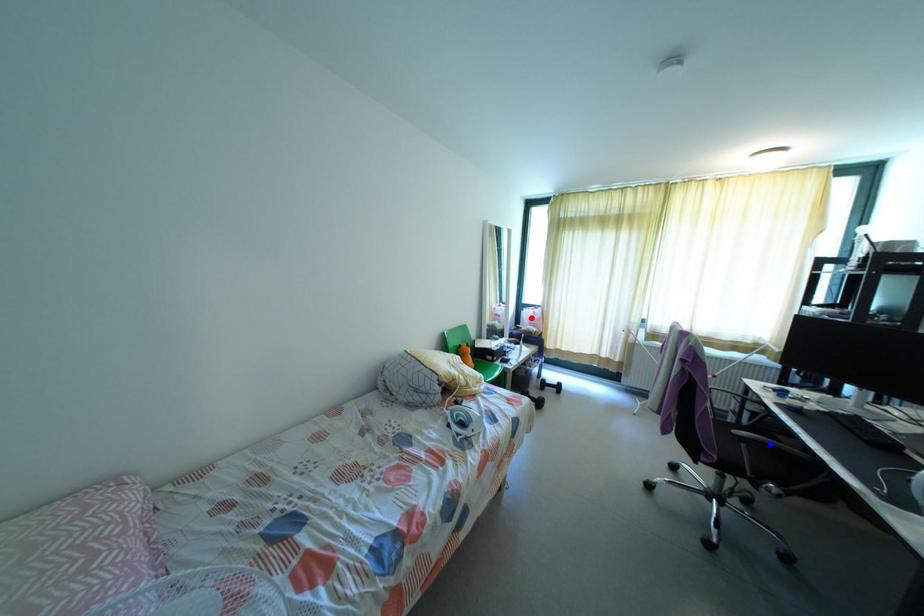
Question: Which of the two points in the image is closer to the camera?

Choices:
 (A) Blue point is closer.
 (B) Red point is closer.

Answer: (A)